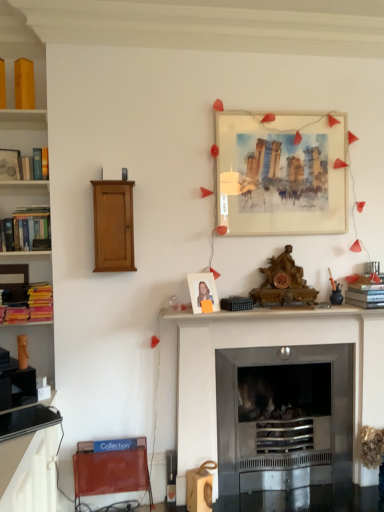
Locate an element on the screen. This screenshot has height=512, width=384. free spot above matte paper picture frame at upper center, the second picture frame when ordered from left to right (from a real-world perspective) is located at coordinates (283, 113).